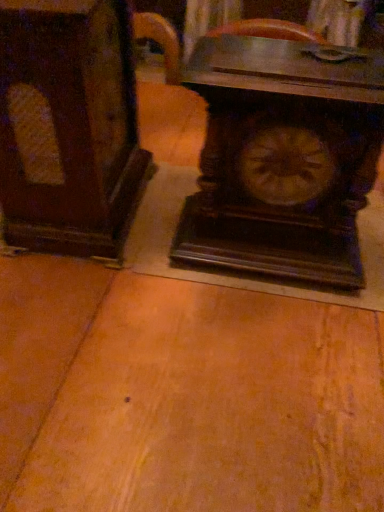
Question: From the image's perspective, is dark wood cabinet at left positioned above or below dark wood table at center?

Choices:
 (A) above
 (B) below

Answer: (A)

Question: From a real-world perspective, is dark wood cabinet at left above or below dark wood table at center?

Choices:
 (A) below
 (B) above

Answer: (B)

Question: Which object is the farthest from the dark wood table at center?

Choices:
 (A) dark wood cabinet at left
 (B) wooden carved clock at center

Answer: (A)

Question: Estimate the real-world distances between objects in this image. Which object is farther from the dark wood table at center?

Choices:
 (A) wooden carved clock at center
 (B) dark wood cabinet at left

Answer: (B)